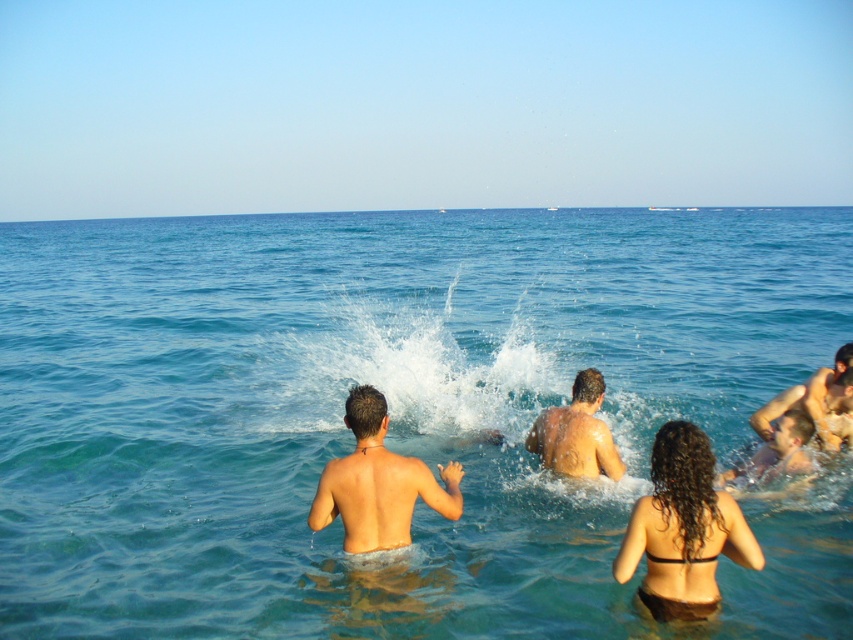
You are a photographer standing at the beach scene. You want to take a photo of two points marked in the image. The first point is at coordinate point (432, 339) and the second is at point (788, 436). Which point is closer to you?

Point (432, 339) is closer to you than point (788, 436) because it is further to the viewer according to the description.

Based on the photo, you are a photographer positioned at the shore, and you want to capture a photo of the matte skin man at center and the smooth skin man at lower right. Based on their positions, which one is closer to the camera?

The matte skin man at center is located above the smooth skin man at lower right, so he is closer to the camera.

You are a photographer trying to capture the reflection of the shiny wet skin at center in the water. Based on the scene, where should you position yourself to best capture this reflection?

To capture the reflection of the shiny wet skin at center, position yourself directly in line with the point at coordinates (576, 433) where the shiny wet skin is located. This ensures the reflection on the water surface is clearly visible.